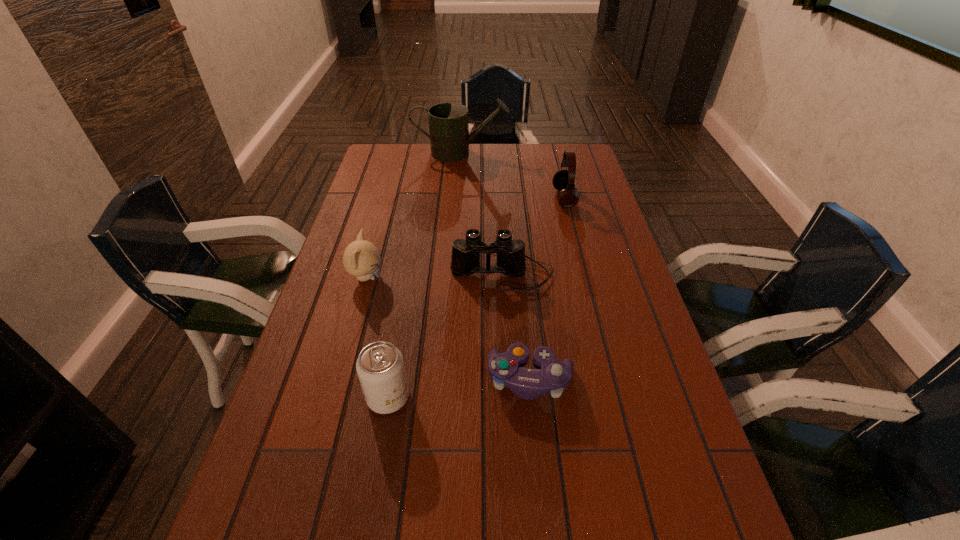
The width and height of the screenshot is (960, 540). In order to click on object at the far left corner in this screenshot , I will do `click(449, 136)`.

You are a GUI agent. You are given a task and a screenshot of the screen. Output one action in this format:
    pyautogui.click(x=<x>, y=<y>)
    Task: Click on the vacant area at the far edge of the desktop
    This screenshot has width=960, height=540.
    Given the screenshot: What is the action you would take?
    pyautogui.click(x=426, y=156)

The image size is (960, 540). I want to click on vacant space at the left edge, so click(364, 214).

Identify the location of free location at the right edge of the desktop. (614, 259).

I want to click on free space at the far right corner of the desktop, so click(x=561, y=155).

At what (x,y) coordinates should I click in order to perform the action: click on vacant point located between the shortest object and the soda can. Please return your answer as a coordinate pair (x, y). This screenshot has width=960, height=540. Looking at the image, I should click on (459, 388).

Find the location of a particular element. free space between the second tallest object and the binoculars is located at coordinates (533, 236).

The width and height of the screenshot is (960, 540). In order to click on free point between the farthest object and the headset in this screenshot , I will do `click(513, 176)`.

Where is `free area in between the headset and the binoculars`? This screenshot has width=960, height=540. free area in between the headset and the binoculars is located at coordinates (533, 236).

Identify the location of vacant space that's between the tallest object and the soda can. (424, 275).